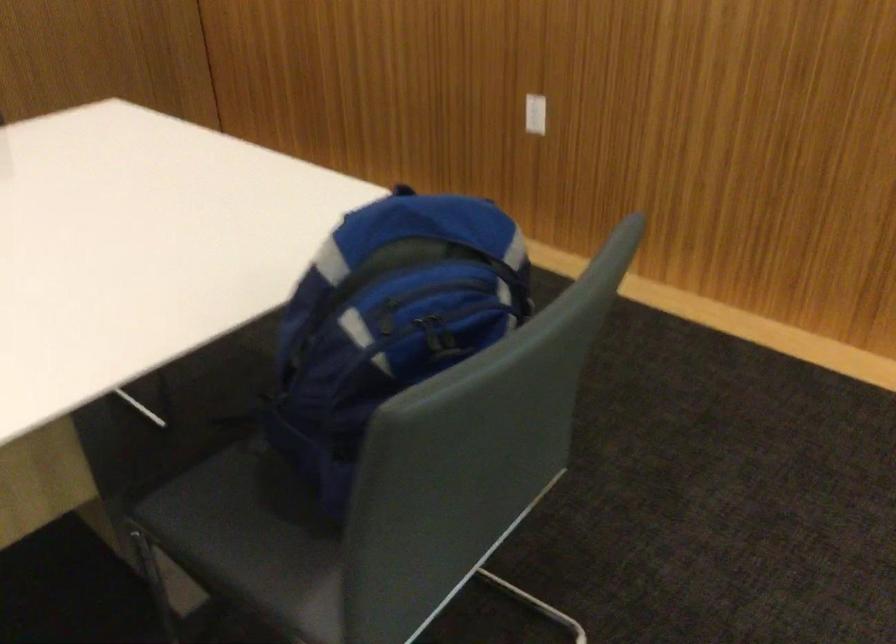
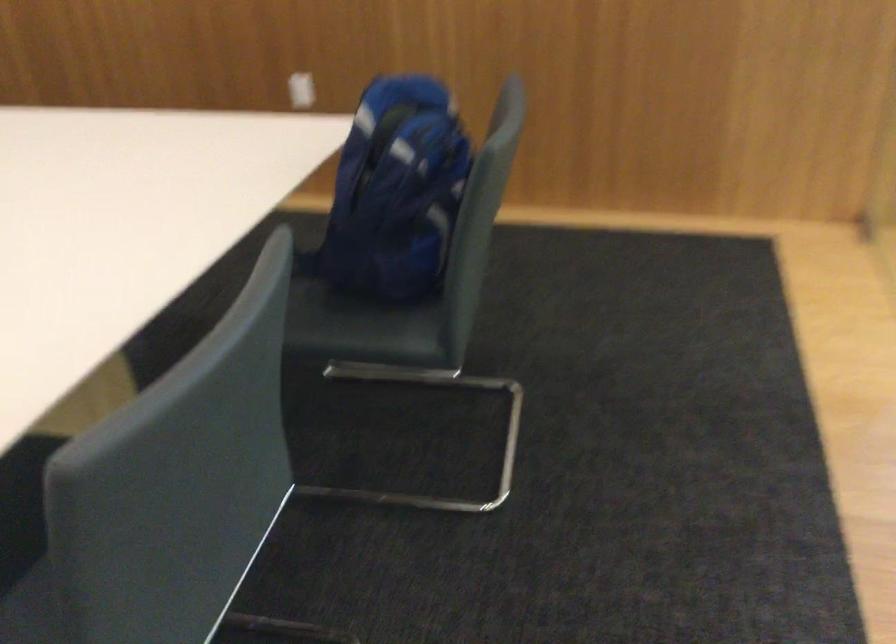
Where in the second image is the point corresponding to (x=349, y=384) from the first image?

(395, 192)